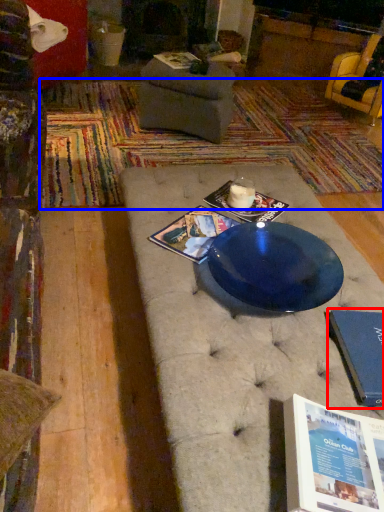
Question: Among these objects, which one is nearest to the camera, paperback book (highlighted by a red box) or mat (highlighted by a blue box)?

Choices:
 (A) paperback book
 (B) mat

Answer: (A)